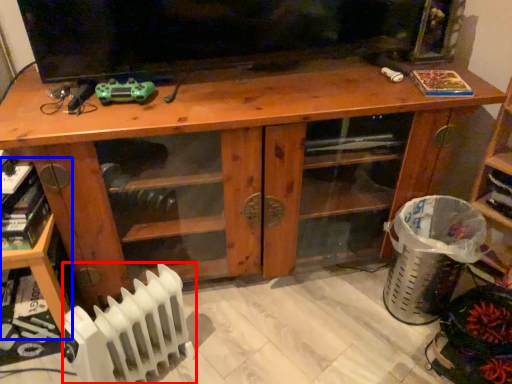
Question: Which of the following is the farthest to the observer, radiator (highlighted by a red box) or shelf (highlighted by a blue box)?

Choices:
 (A) radiator
 (B) shelf

Answer: (B)